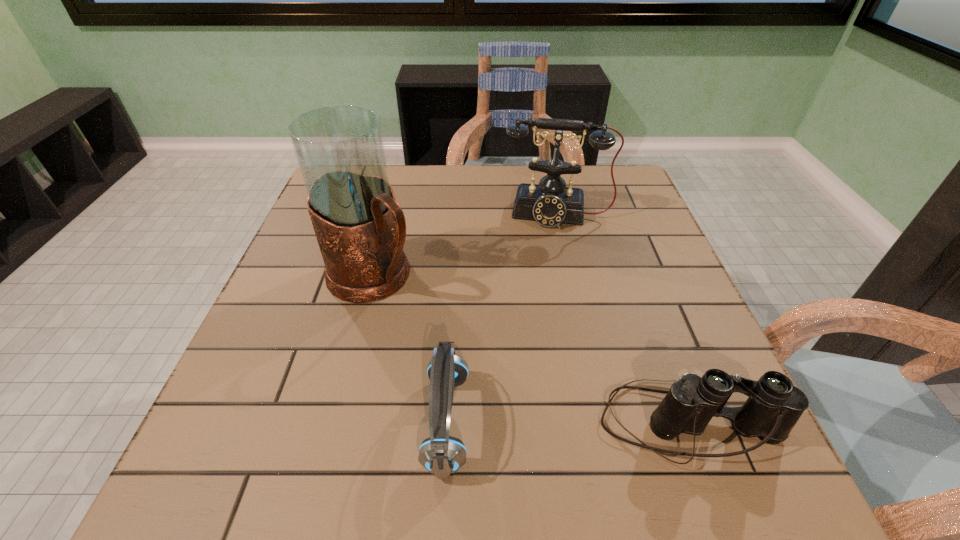
Where is `vacant region between the telephone and the third nearest object`? vacant region between the telephone and the third nearest object is located at coordinates (465, 246).

Locate an element on the screen. vacant space in between the headset and the tallest object is located at coordinates (410, 349).

In order to click on free point between the headset and the second tallest object in this screenshot , I will do `click(501, 318)`.

Locate an element on the screen. The width and height of the screenshot is (960, 540). vacant region between the leftmost object and the second object from left to right is located at coordinates (410, 349).

Identify the location of blank region between the pitcher and the farthest object. (465, 246).

Find the location of a particular element. The image size is (960, 540). vacant area that lies between the binoculars and the telephone is located at coordinates (622, 319).

This screenshot has height=540, width=960. Find the location of `unoccupied area between the telephone and the headset`. unoccupied area between the telephone and the headset is located at coordinates (501, 318).

Where is `free area in between the third object from right to left and the third shortest object`? free area in between the third object from right to left and the third shortest object is located at coordinates (501, 318).

You are a GUI agent. You are given a task and a screenshot of the screen. Output one action in this format:
    pyautogui.click(x=<x>, y=<y>)
    Task: Click on the third closest object relative to the second farthest object
    The width and height of the screenshot is (960, 540).
    Given the screenshot: What is the action you would take?
    pyautogui.click(x=774, y=406)

At what (x,y) coordinates should I click in order to perform the action: click on object that is the third nearest to the second tallest object. Please return your answer as a coordinate pair (x, y). The height and width of the screenshot is (540, 960). Looking at the image, I should click on (774, 406).